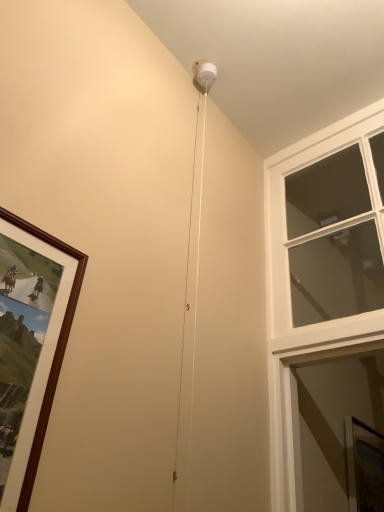
Question: From the image's perspective, is clear glass window at upper right above or below clear glass window screen at lower right?

Choices:
 (A) below
 (B) above

Answer: (B)

Question: In the image, is clear glass window at upper right positioned in front of or behind clear glass window screen at lower right?

Choices:
 (A) front
 (B) behind

Answer: (A)

Question: Considering the positions of clear glass window at upper right and clear glass window screen at lower right in the image, is clear glass window at upper right bigger or smaller than clear glass window screen at lower right?

Choices:
 (A) big
 (B) small

Answer: (A)

Question: From the image's perspective, is clear glass window screen at lower right located above or below clear glass window at upper right?

Choices:
 (A) above
 (B) below

Answer: (B)

Question: Would you say clear glass window screen at lower right is inside or outside clear glass window at upper right?

Choices:
 (A) inside
 (B) outside

Answer: (B)

Question: Based on their positions, is clear glass window screen at lower right located to the left or right of clear glass window at upper right?

Choices:
 (A) right
 (B) left

Answer: (A)

Question: From a real-world perspective, is clear glass window screen at lower right above or below clear glass window at upper right?

Choices:
 (A) below
 (B) above

Answer: (A)